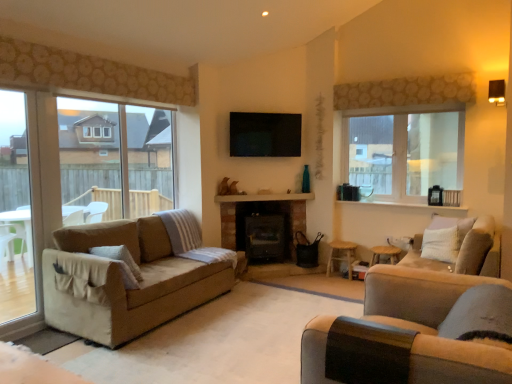
Question: Is wooden stool at lower right, which is the first stool from right to left, with brick fireplace at center?

Choices:
 (A) yes
 (B) no

Answer: (B)

Question: Is wooden stool at lower right, which is the first stool from right to left, behind brick fireplace at center?

Choices:
 (A) no
 (B) yes

Answer: (A)

Question: From a real-world perspective, is wooden stool at lower right, placed as the 2th stool when sorted from left to right, physically above brick fireplace at center?

Choices:
 (A) no
 (B) yes

Answer: (A)

Question: Considering the relative sizes of wooden stool at lower right, which is the first stool from right to left, and brick fireplace at center in the image provided, is wooden stool at lower right, which is the first stool from right to left, thinner than brick fireplace at center?

Choices:
 (A) no
 (B) yes

Answer: (A)

Question: Is wooden stool at lower right, placed as the 2th stool when sorted from left to right, not inside brick fireplace at center?

Choices:
 (A) no
 (B) yes

Answer: (B)

Question: From a real-world perspective, is wooden stool at lower right, placed as the 2th stool when sorted from left to right, beneath brick fireplace at center?

Choices:
 (A) no
 (B) yes

Answer: (B)

Question: Can we say wooden stool at lower right, which is the first stool from right to left, lies outside clear glass window at upper right, the 1th window in the right-to-left sequence?

Choices:
 (A) yes
 (B) no

Answer: (A)

Question: Can you confirm if wooden stool at lower right, placed as the 2th stool when sorted from left to right, is smaller than clear glass window at upper right, the second window in the left-to-right sequence?

Choices:
 (A) yes
 (B) no

Answer: (A)

Question: Could you tell me if wooden stool at lower right, which is the first stool from right to left, is facing clear glass window at upper right, the second window in the left-to-right sequence?

Choices:
 (A) no
 (B) yes

Answer: (A)

Question: Considering the relative sizes of wooden stool at lower right, which is the first stool from right to left, and clear glass window at upper right, the 1th window in the right-to-left sequence, in the image provided, is wooden stool at lower right, which is the first stool from right to left, thinner than clear glass window at upper right, the 1th window in the right-to-left sequence,?

Choices:
 (A) yes
 (B) no

Answer: (B)

Question: Considering the relative sizes of wooden stool at lower right, which is the first stool from right to left, and clear glass window at upper right, the 1th window in the right-to-left sequence, in the image provided, is wooden stool at lower right, which is the first stool from right to left, bigger than clear glass window at upper right, the 1th window in the right-to-left sequence,?

Choices:
 (A) yes
 (B) no

Answer: (B)

Question: Is wooden stool at lower right, placed as the 2th stool when sorted from left to right, placed right next to clear glass window at upper right, the second window in the left-to-right sequence?

Choices:
 (A) yes
 (B) no

Answer: (B)

Question: Is beige fabric couch at right positioned before beige fabric couch at lower right, marked as the 2th studio couch in a right-to-left arrangement?

Choices:
 (A) yes
 (B) no

Answer: (B)